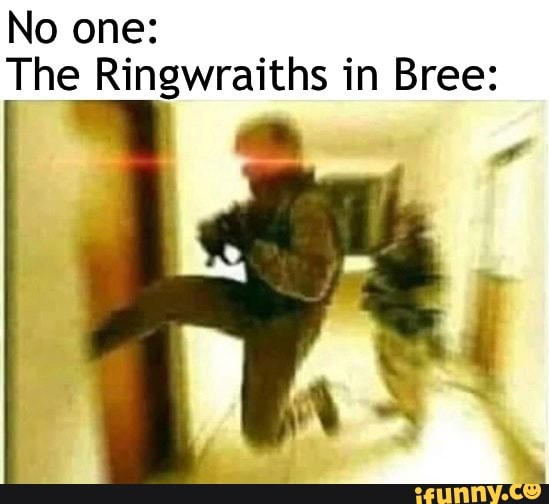
Locate an element on the screen. ceiling is located at coordinates (372, 119).